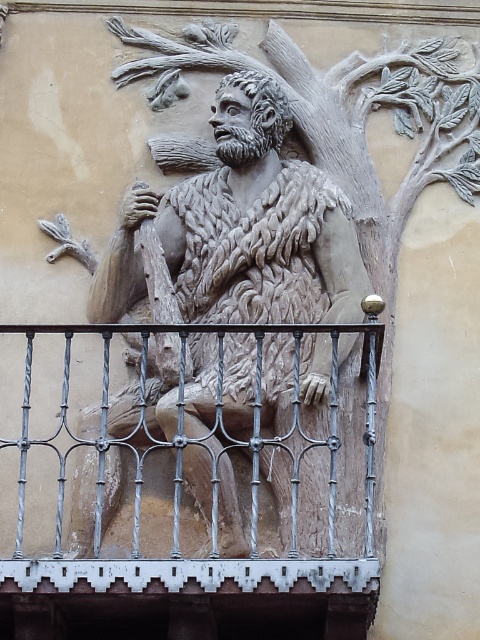
Question: Can you confirm if carved stone figure at center is positioned below polished metal railing at center?

Choices:
 (A) no
 (B) yes

Answer: (A)

Question: Which point appears closest to the camera in this image?

Choices:
 (A) (249, 340)
 (B) (247, 333)

Answer: (A)

Question: Is carved stone figure at center to the left of polished metal railing at center from the viewer's perspective?

Choices:
 (A) no
 (B) yes

Answer: (A)

Question: Can you confirm if carved stone figure at center is positioned below polished metal railing at center?

Choices:
 (A) yes
 (B) no

Answer: (B)

Question: Which point is farther to the camera?

Choices:
 (A) carved stone figure at center
 (B) polished metal railing at center

Answer: (A)